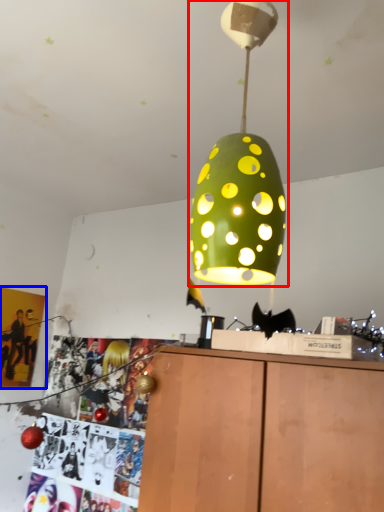
Question: Among these objects, which one is farthest to the camera, lamp (highlighted by a red box) or poster page (highlighted by a blue box)?

Choices:
 (A) lamp
 (B) poster page

Answer: (B)